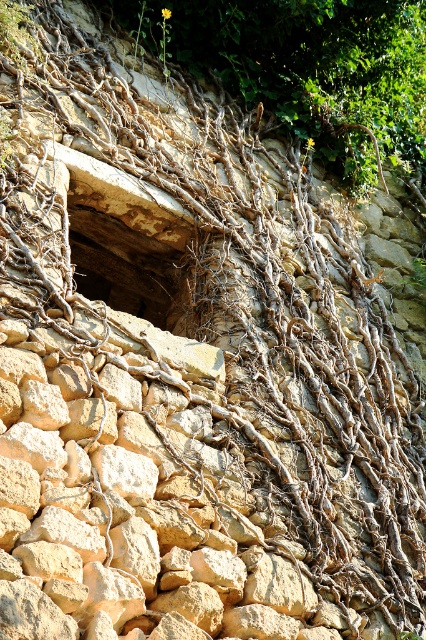
You are a GUI agent. You are given a task and a screenshot of the screen. Output one action in this format:
    pyautogui.click(x=<x>, y=<y>)
    Task: Click on the brown rough roots at center
    Image resolution: width=426 pixels, height=640 pixels.
    Given the screenshot: What is the action you would take?
    pyautogui.click(x=307, y=68)